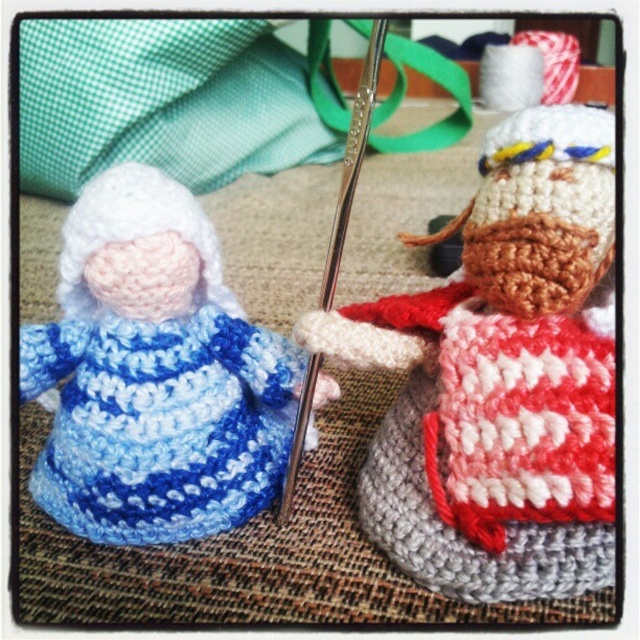
You are organizing a craft fair and need to display the red and white knitted sweater at center and the blue yarn doll at left. Since the display shelf has limited height, you want to ensure that the tallest item is placed at the back. Which item should be placed at the back?

The blue yarn doll at left should be placed at the back because the red and white knitted sweater at center is positioned under it, indicating that the blue yarn doll is taller.

You are holding a crochet hook that is 12 inches long. You want to reach the point at coordinate (371, 465) in the image to start a new stitch. Is your crochet hook long enough to reach that point without moving closer?

The distance of point (371, 465) from the viewer is 37.43 inches. Since the crochet hook is only 12 inches long, it is not long enough to reach the point at that distance.

You are organizing a craft fair and need to display the red and white knitted sweater at center and the blue yarn doll at left. Which item takes up more space on the display table?

The blue yarn doll at left takes up more space on the display table because it is larger than the red and white knitted sweater at center.